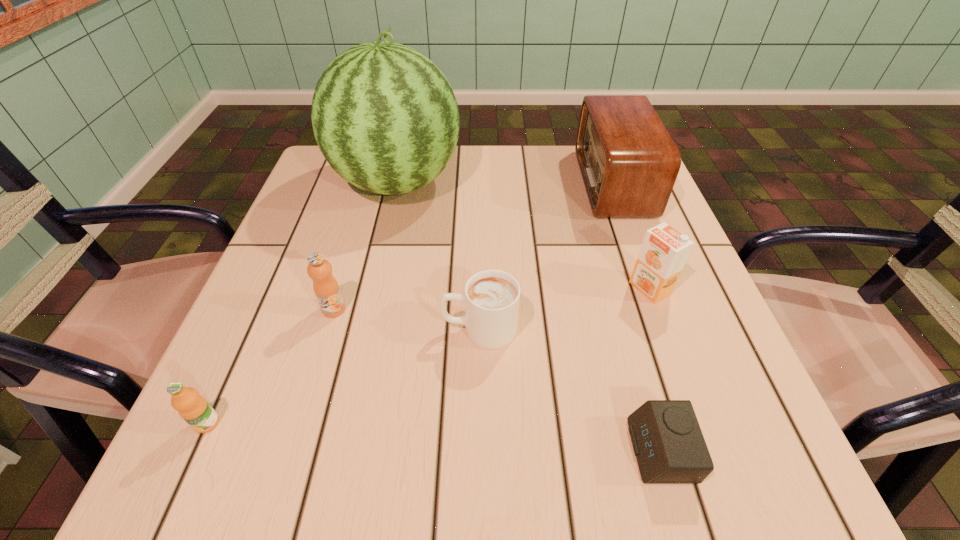
You are a GUI agent. You are given a task and a screenshot of the screen. Output one action in this format:
    pyautogui.click(x=<x>, y=<y>)
    Task: Click on the watermelon present at the far edge
    
    Given the screenshot: What is the action you would take?
    pyautogui.click(x=384, y=116)

Image resolution: width=960 pixels, height=540 pixels. What are the coordinates of `radio receiver located in the far edge section of the desktop` in the screenshot? It's located at (629, 163).

Where is `orange juice present at the near edge`? This screenshot has width=960, height=540. orange juice present at the near edge is located at coordinates (193, 408).

What are the coordinates of `alarm clock at the near edge` in the screenshot? It's located at (667, 440).

At what (x,y) coordinates should I click in order to perform the action: click on watermelon located in the left edge section of the desktop. Please return your answer as a coordinate pair (x, y). The image size is (960, 540). Looking at the image, I should click on tap(384, 116).

This screenshot has height=540, width=960. I want to click on radio receiver at the right edge, so click(629, 163).

You are a GUI agent. You are given a task and a screenshot of the screen. Output one action in this format:
    pyautogui.click(x=<x>, y=<y>)
    Task: Click on the orange juice that is at the right edge
    The height and width of the screenshot is (540, 960).
    Given the screenshot: What is the action you would take?
    pyautogui.click(x=664, y=251)

At what (x,y) coordinates should I click in order to perform the action: click on alarm clock located in the right edge section of the desktop. Please return your answer as a coordinate pair (x, y). The height and width of the screenshot is (540, 960). Looking at the image, I should click on (667, 440).

Locate an element on the screen. The image size is (960, 540). object that is at the far left corner is located at coordinates (384, 116).

The image size is (960, 540). Find the location of `object present at the near left corner`. object present at the near left corner is located at coordinates (193, 408).